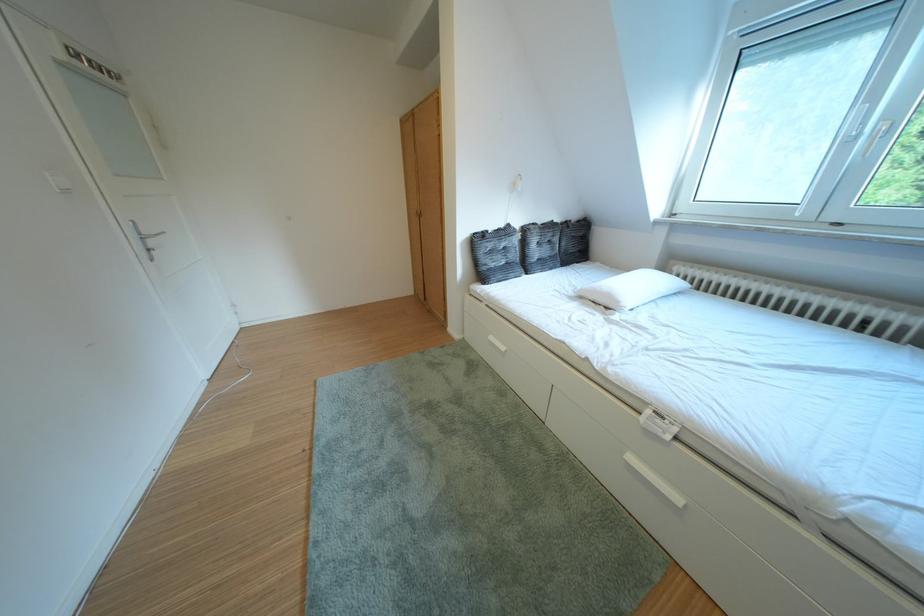
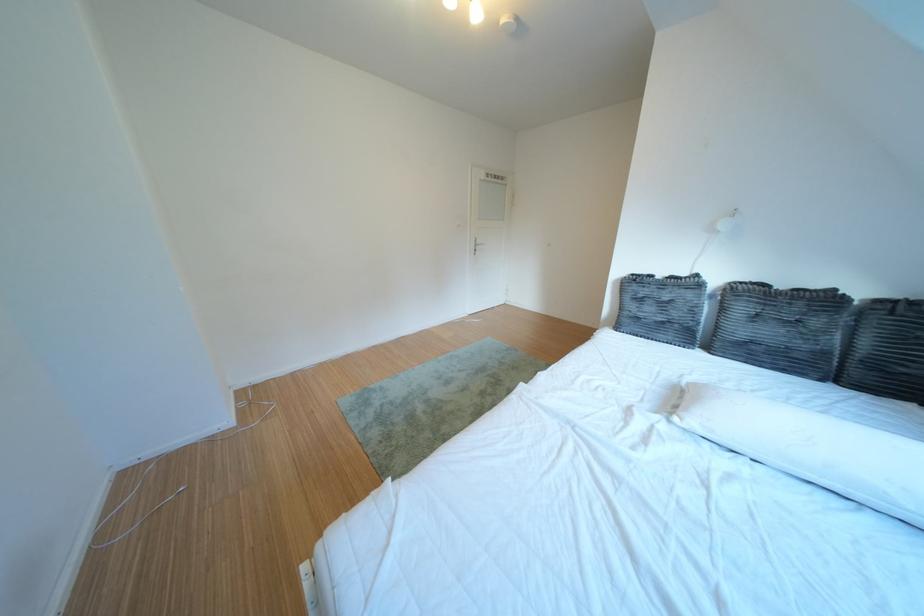
Where in the second image is the point corresponding to the point at 497,273 from the first image?

(639, 318)